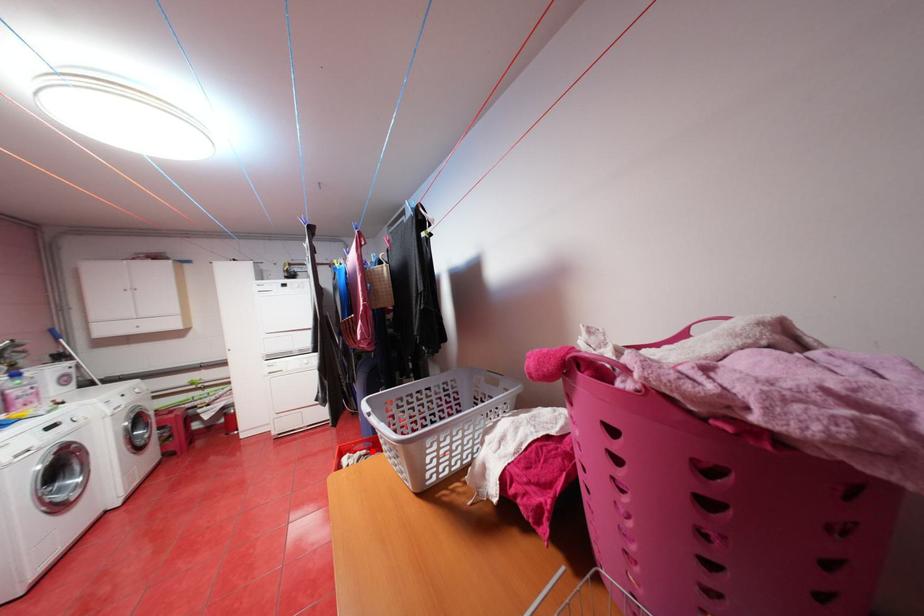
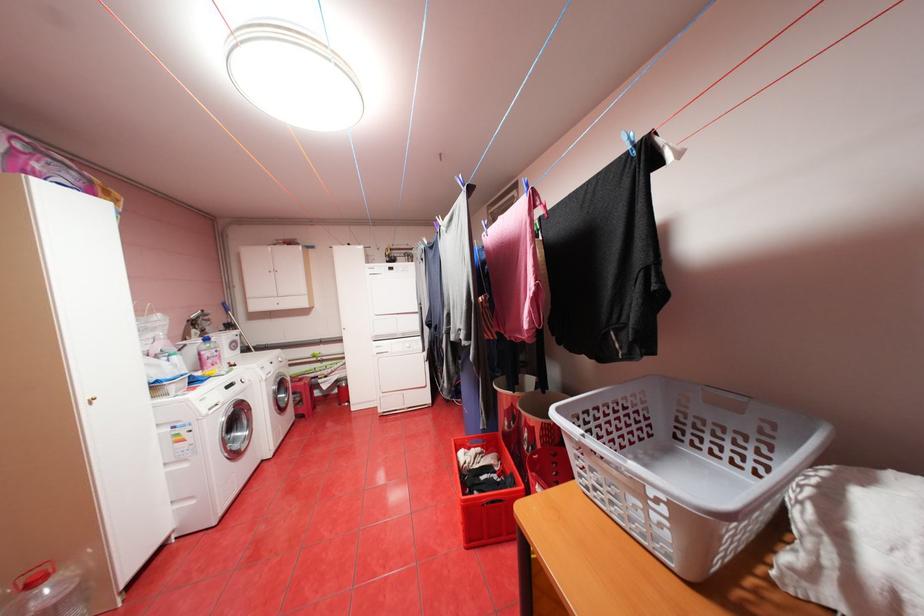
Question: I am providing you with two images of the same scene from different viewpoints. Given a red point in image1, look at the same physical point in image2. Is it:

Choices:
 (A) Closer to the viewpoint
 (B) Farther from the viewpoint

Answer: (A)